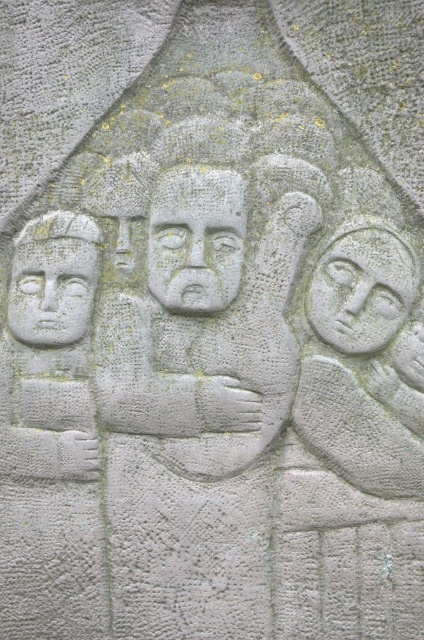
Question: Does carved stone face at center have a smaller size compared to gray stone face at left?

Choices:
 (A) yes
 (B) no

Answer: (B)

Question: Is gray stone face at right below gray stone face at left?

Choices:
 (A) yes
 (B) no

Answer: (B)

Question: Which point is closer to the camera?

Choices:
 (A) (359, 310)
 (B) (195, 253)

Answer: (A)

Question: Which point is closer to the camera?

Choices:
 (A) (17, 278)
 (B) (406, 250)
 (C) (236, 259)

Answer: (C)

Question: Observing the image, what is the correct spatial positioning of gray stone face at right in reference to gray stone face at left?

Choices:
 (A) right
 (B) left

Answer: (A)

Question: Which point appears closest to the camera in this image?

Choices:
 (A) (38, 323)
 (B) (173, 177)
 (C) (410, 282)

Answer: (C)